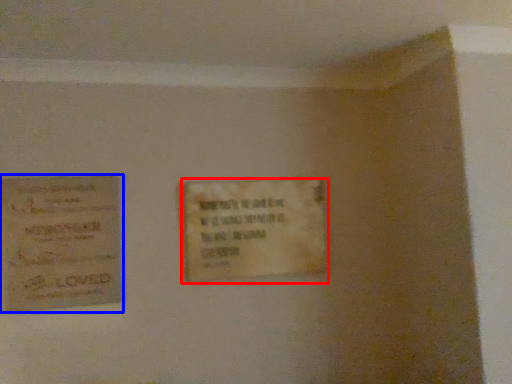
Question: Which object appears closest to the camera in this image, plaque (highlighted by a red box) or poster (highlighted by a blue box)?

Choices:
 (A) plaque
 (B) poster

Answer: (B)